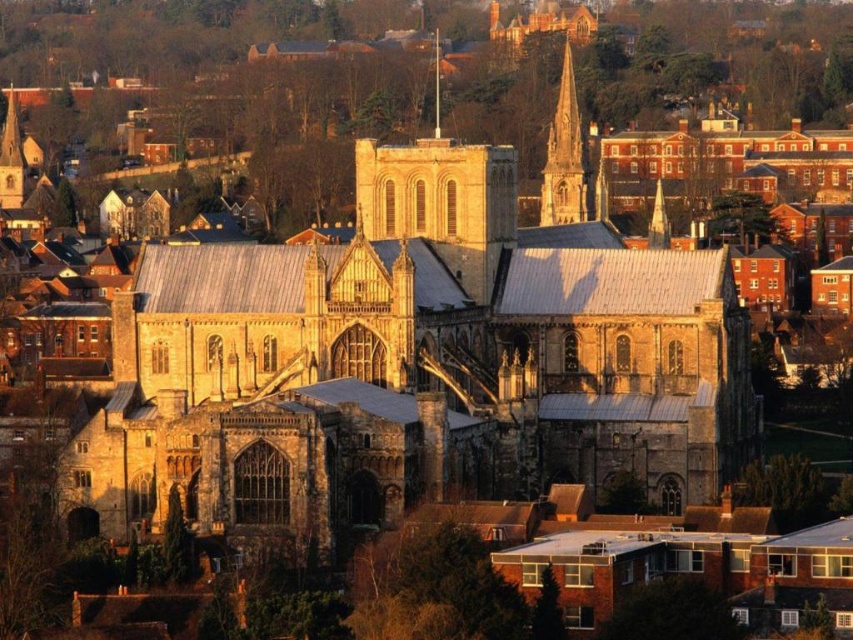
Can you confirm if stone church at center is smaller than smooth stone spire at upper center?

No, stone church at center is not smaller than smooth stone spire at upper center.

Between point (451, 150) and point (554, 109), which one is positioned behind?

The point (554, 109) is behind.

Is point (113, 509) less distant than point (548, 209)?

That is True.

Identify the location of stone church at center. This screenshot has height=640, width=853. (415, 364).